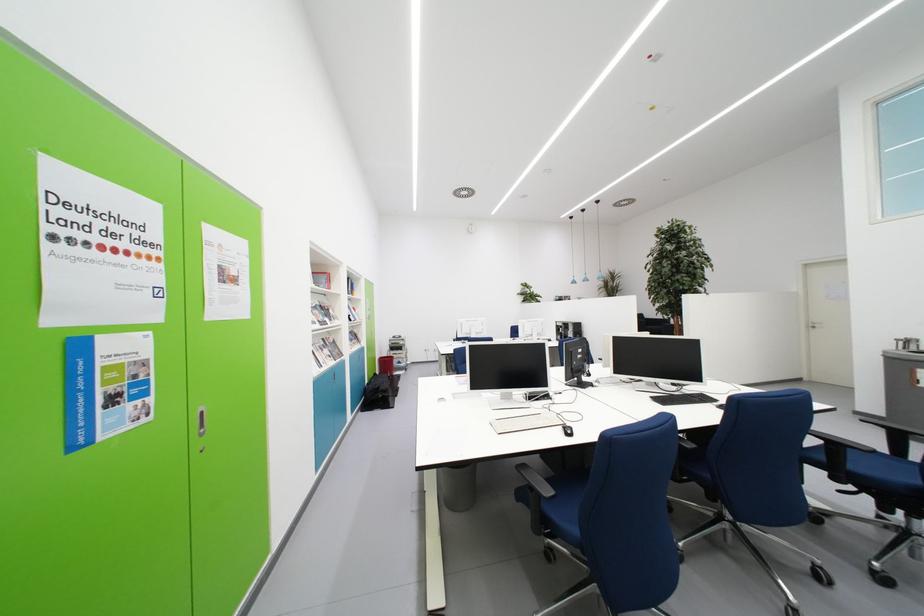
Locate an element on the screen. This screenshot has width=924, height=616. computer mouse is located at coordinates (566, 430).